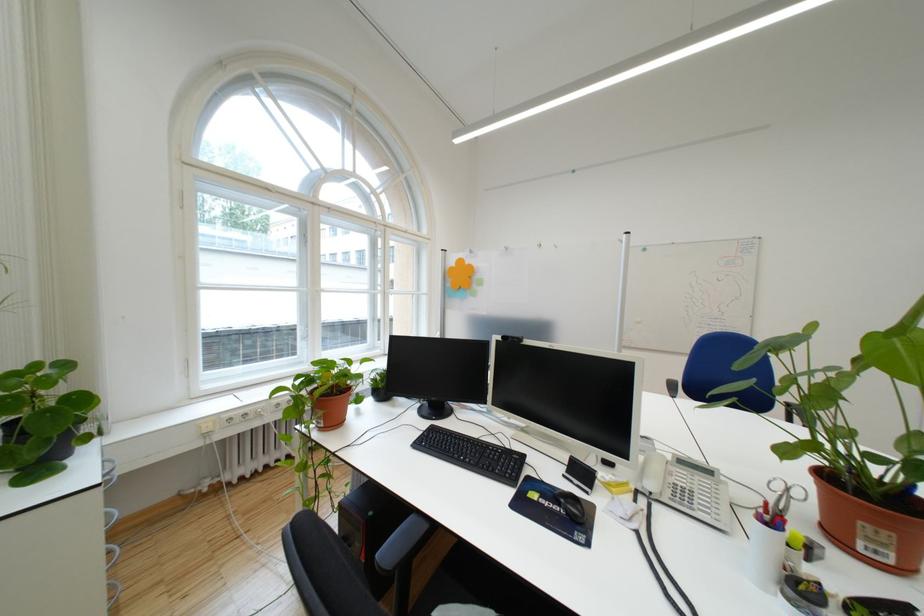
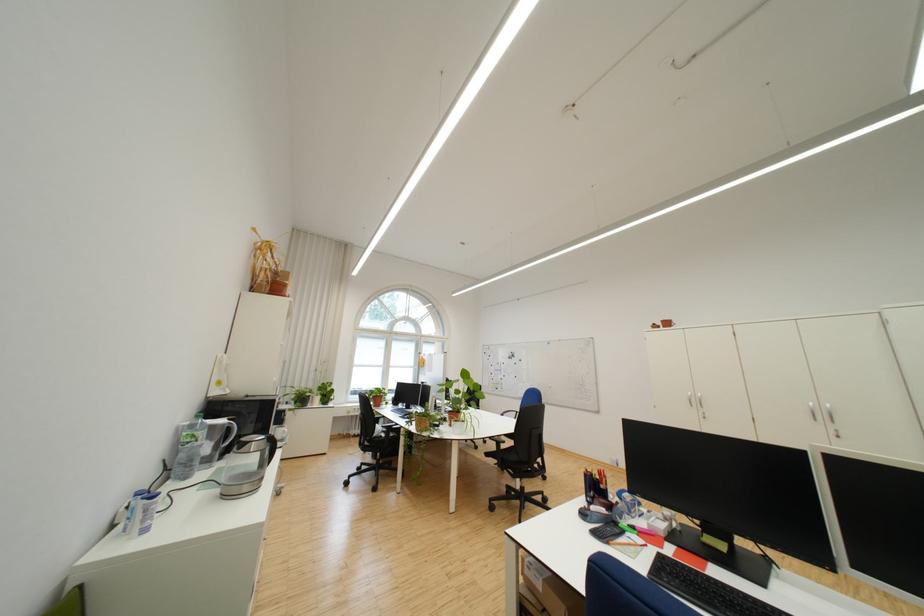
Which direction would the cameraman need to move to produce the second image?

The movement direction of the cameraman is right, backward.